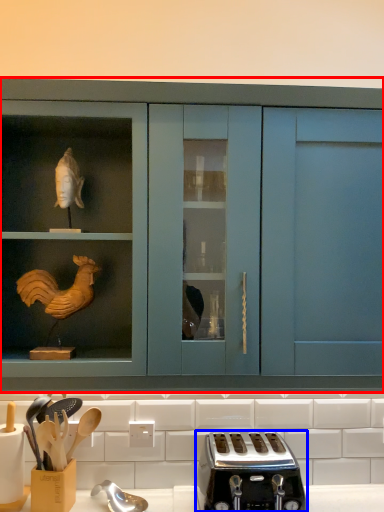
Question: Which of the following is the closest to the observer, cabinetry (highlighted by a red box) or toaster (highlighted by a blue box)?

Choices:
 (A) cabinetry
 (B) toaster

Answer: (A)